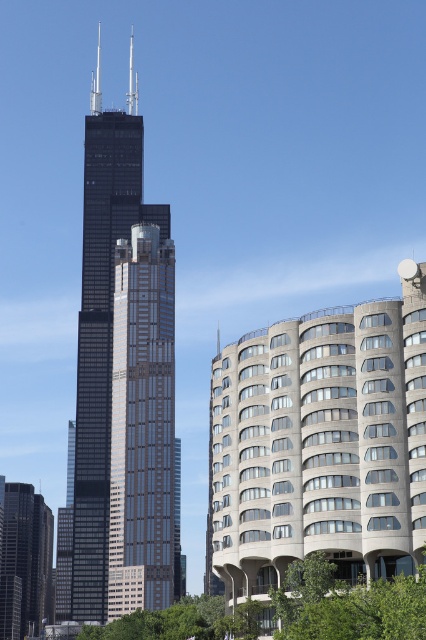
You are standing in the middle of the urban landscape and want to take a photo of the gray concrete building at right and the black glass skyscraper at center. Which building should you focus on first if you want to include both in your frame without moving the camera?

You should focus on the gray concrete building at right first because it is closer to you than the black glass skyscraper at center, allowing both to be in the same frame without moving the camera.

You are standing in the urban landscape and see the point marked at coordinates (x=319, y=444). Which building does this point belong to?

The point marked at coordinates (x=319, y=444) is on the gray concrete building at right.